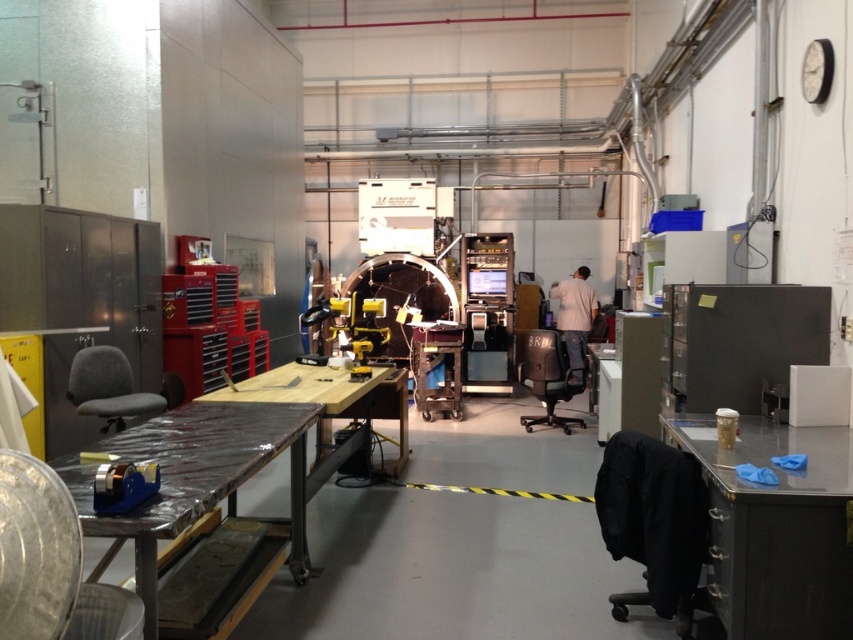
Between point (845, 474) and point (148, 506), which one is positioned behind?

Positioned behind is point (845, 474).

Is gray matte workbench at lower right taller than metallic/plastic workbench at lower left?

Indeed, gray matte workbench at lower right has a greater height compared to metallic/plastic workbench at lower left.

Is point (718, 458) in front of point (177, 486)?

That is False.

This screenshot has width=853, height=640. Identify the location of gray matte workbench at lower right. (775, 529).

Does point (184, 506) come farther from viewer compared to point (575, 300)?

No, (184, 506) is in front of (575, 300).

Who is more forward, (206, 460) or (575, 321)?

Point (206, 460) is more forward.

The height and width of the screenshot is (640, 853). Describe the element at coordinates (184, 472) in the screenshot. I see `metallic/plastic workbench at lower left` at that location.

Locate an element on the screen. metallic/plastic workbench at lower left is located at coordinates (184, 472).

Does gray matte workbench at lower right have a smaller size compared to light beige shirt at center?

Indeed, gray matte workbench at lower right has a smaller size compared to light beige shirt at center.

Does point (788, 474) come behind point (567, 321)?

No, (788, 474) is closer to viewer.

I want to click on gray matte workbench at lower right, so click(x=775, y=529).

At what (x,y) coordinates should I click in order to perform the action: click on gray matte workbench at lower right. Please return your answer as a coordinate pair (x, y). This screenshot has width=853, height=640. Looking at the image, I should click on (775, 529).